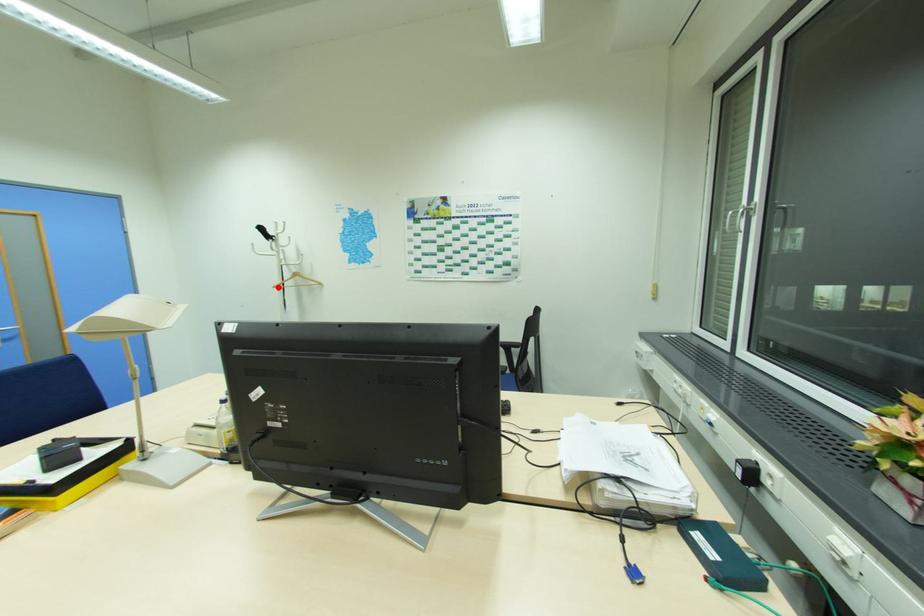
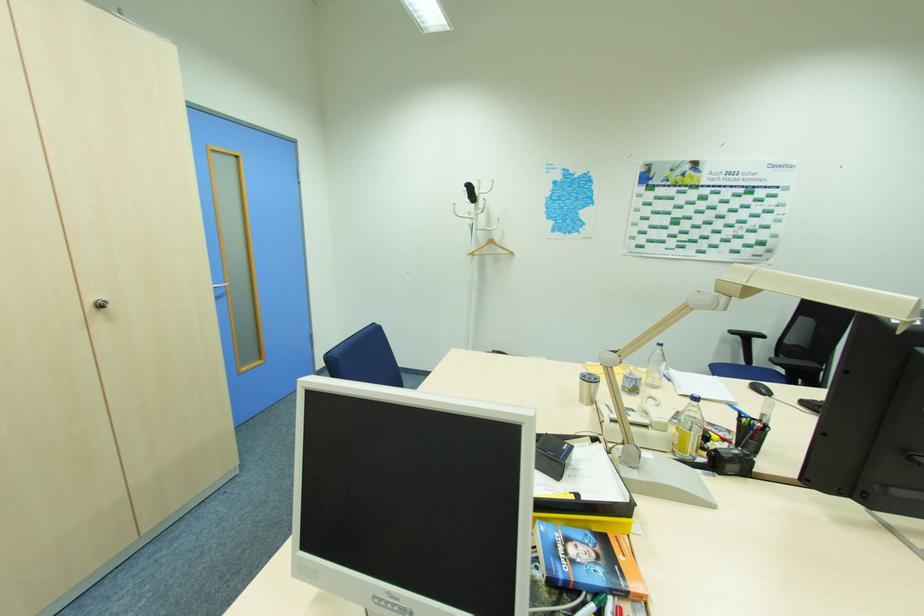
Question: I am providing you with two images of the same scene from different viewpoints. A red point is marked on the first image. At the location where the point appears in image 1, is it still visible in image 2?

Choices:
 (A) Yes
 (B) No

Answer: (A)